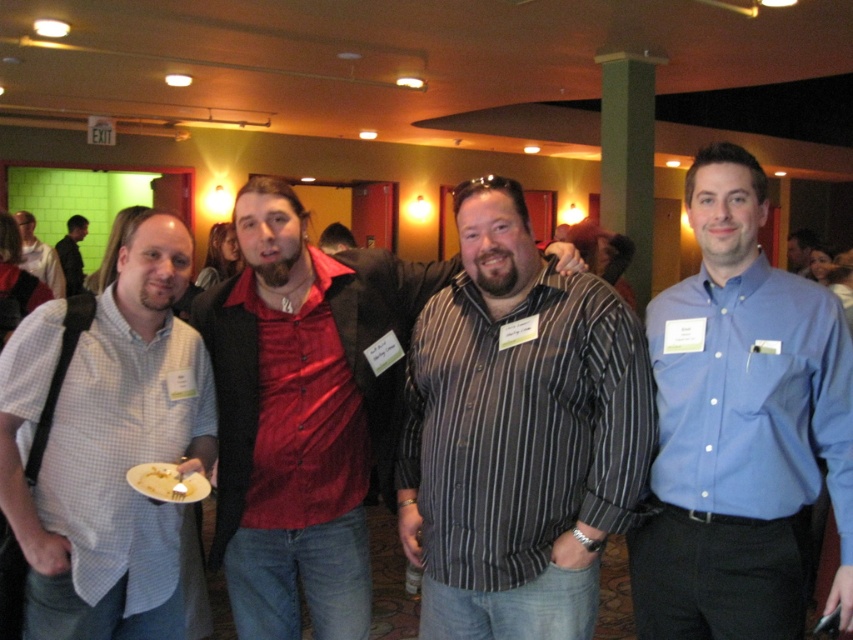
Is white checkered shirt at left above white matte plate at lower left?

Yes.

Is point (30, 552) in front of point (190, 493)?

Yes, point (30, 552) is in front of point (190, 493).

You are a GUI agent. You are given a task and a screenshot of the screen. Output one action in this format:
    pyautogui.click(x=<x>, y=<y>)
    Task: Click on the white checkered shirt at left
    This screenshot has height=640, width=853.
    Given the screenshot: What is the action you would take?
    click(108, 448)

Does striped cotton shirt at center lie behind white creamy food at lower left?

Yes.

Does striped cotton shirt at center appear on the left side of white creamy food at lower left?

No, striped cotton shirt at center is not to the left of white creamy food at lower left.

Between point (643, 381) and point (154, 467), which one is positioned in front?

Point (643, 381) is more forward.

You are a GUI agent. You are given a task and a screenshot of the screen. Output one action in this format:
    pyautogui.click(x=<x>, y=<y>)
    Task: Click on the striped cotton shirt at center
    This screenshot has height=640, width=853.
    Given the screenshot: What is the action you would take?
    pyautogui.click(x=518, y=433)

Who is higher up, blue button-down shirt at center or shiny red shirt at center?

blue button-down shirt at center is higher up.

Does point (695, 625) come in front of point (264, 291)?

That is True.

Does point (763, 576) come in front of point (285, 307)?

Yes, it is in front of point (285, 307).

Find the location of a particular element. This screenshot has width=853, height=640. blue button-down shirt at center is located at coordinates (741, 428).